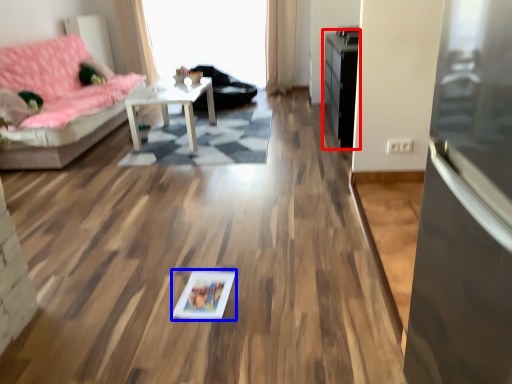
Question: Which object is closer to the camera taking this photo, dresser (highlighted by a red box) or picture frame (highlighted by a blue box)?

Choices:
 (A) dresser
 (B) picture frame

Answer: (B)